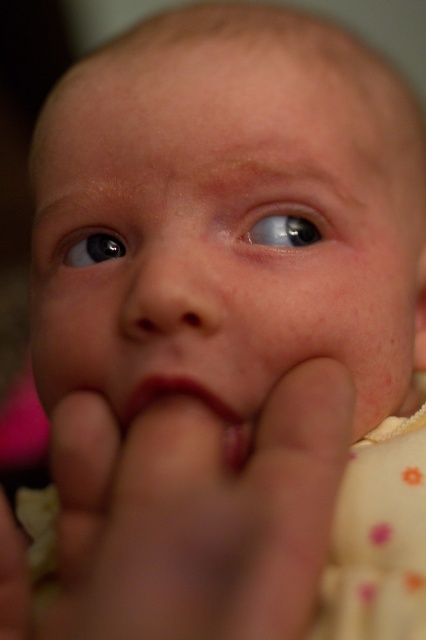
Who is lower down, smooth skin baby face at center or smooth skin finger at lower center?

smooth skin finger at lower center is lower down.

Locate an element on the screen. smooth skin baby face at center is located at coordinates (224, 228).

Measure the distance between smooth skin baby face at center and camera.

The distance of smooth skin baby face at center from camera is 10.47 inches.

Locate an element on the screen. Image resolution: width=426 pixels, height=640 pixels. smooth skin baby face at center is located at coordinates (224, 228).

Between smooth skin finger at lower center and glossy blue eye at upper left, which one is positioned higher?

glossy blue eye at upper left is above.

Can you confirm if smooth skin finger at lower center is taller than glossy blue eye at upper left?

Yes, smooth skin finger at lower center is taller than glossy blue eye at upper left.

Locate an element on the screen. smooth skin finger at lower center is located at coordinates (196, 515).

Does point (152, 381) come farther from viewer compared to point (54, 568)?

No.

Does point (219, 403) come closer to viewer compared to point (31, 508)?

Yes, it is.

In order to click on pink matte lips at center in this screenshot , I will do `click(198, 401)`.